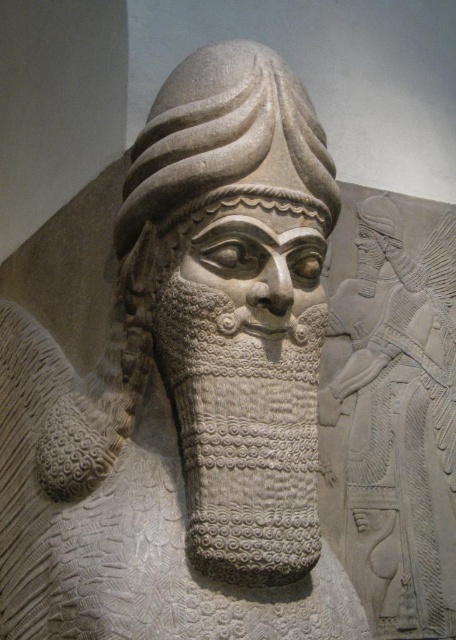
You are an art conservator examining the stone relief sculpture. You notice two gray stone heads in the scene. Which one is closer to you, the gray stone head at center or the gray stone head at upper right?

The gray stone head at center is closer to you because it is in front of the gray stone head at upper right.

You are an archaeologist examining the stone relief sculpture. You notice a point marked at coordinates (226, 141). Based on the scene description, what significant feature does this point likely indicate?

The point at (226, 141) marks the gray stone head at center, which is the central figure of the relief sculpture depicting a high ranking official or deity with a tall conical hat and intricate beard detailing.